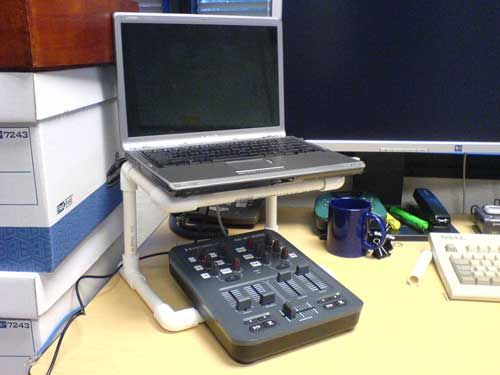
Where is `mug handle`? The image size is (500, 375). mug handle is located at coordinates (384, 233).